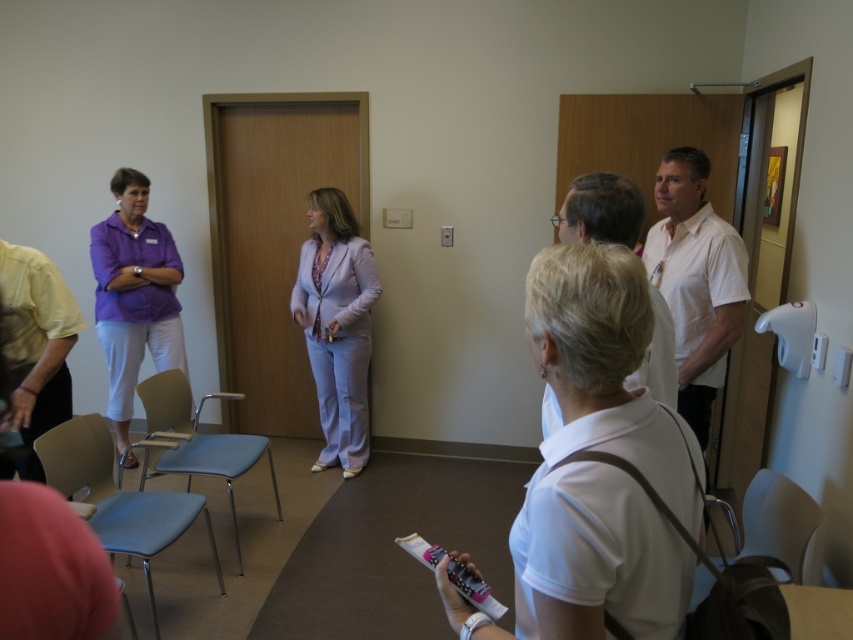
You are standing at the entrance of the room and see the lavender fabric suit at center and the light blue plastic chair at lower left. Which object is closer to your right side?

The lavender fabric suit at center is to the right of the light blue plastic chair at lower left, so the lavender fabric suit at center is closer to your right side.

You are organizing a meeting in this room and need to ensure there is enough space between the lavender fabric suit at center and the light blue plastic chair at lower left for a person to walk through. Based on their sizes, is there sufficient space?

The lavender fabric suit at center has a lesser width compared to light blue plastic chair at lower left, so there is likely enough space between them for a person to walk through.

Consider the image. You are standing in the room and want to move from the wooden elevator at center to the lavender fabric suit at center. Which direction should you move towards?

The wooden elevator at center is positioned on the left side of lavender fabric suit at center, so you should move towards the right to reach the lavender fabric suit at center.